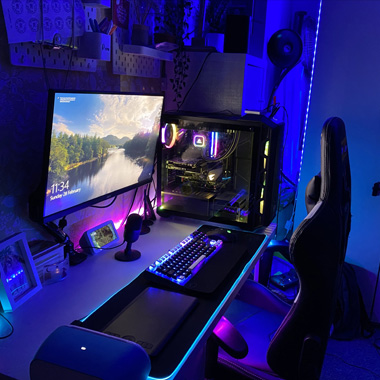
What are the coordinates of `small shelf` in the screenshot? It's located at (154, 52).